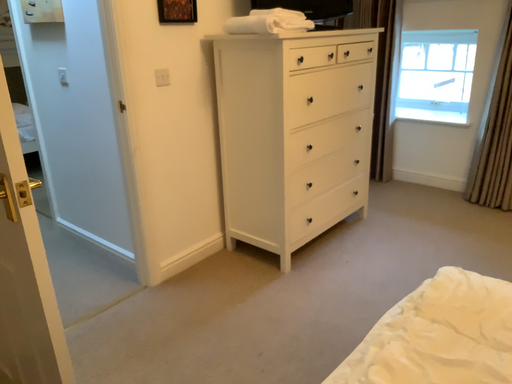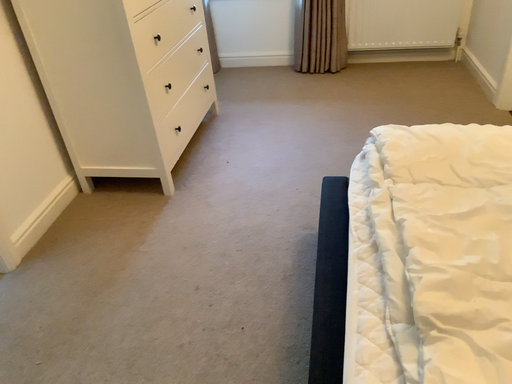
Question: How did the camera likely rotate when shooting the video?

Choices:
 (A) rotated left
 (B) rotated right

Answer: (B)